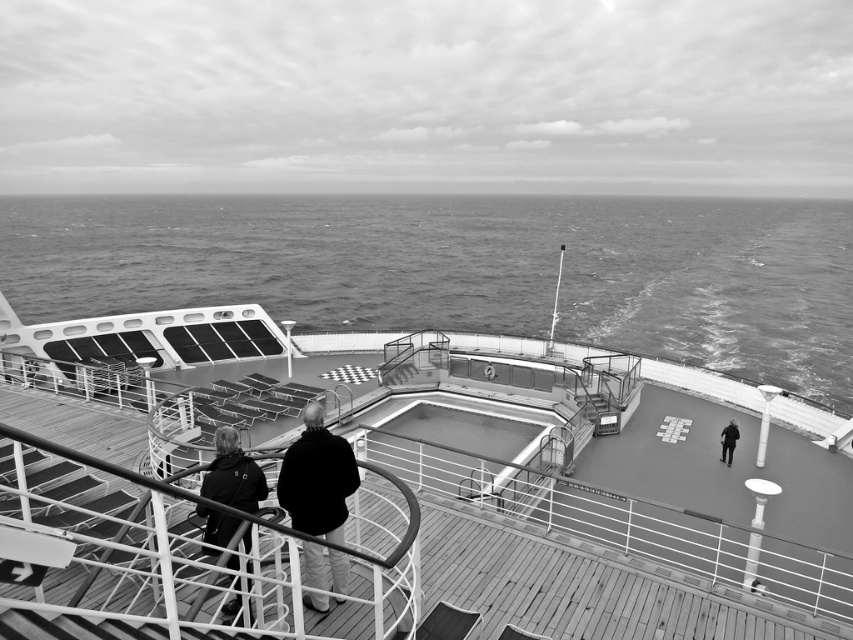
You are on the deck of a ship and want to know which object takes up more space in the photo between the dark gray water at center and the dark gray fabric jacket at lower left. Which one is larger?

The dark gray water at center is bigger than the dark gray fabric jacket at lower left, so the water takes up more space in the photo.

You are a photographer on the ship deck. You need to capture a photo where both the dark gray fabric jacket at lower left and the dark gray fabric jacket at center right are visible. Which jacket will appear wider in the photo?

The dark gray fabric jacket at lower left will appear wider in the photo because its width surpasses that of the dark gray fabric jacket at center right.